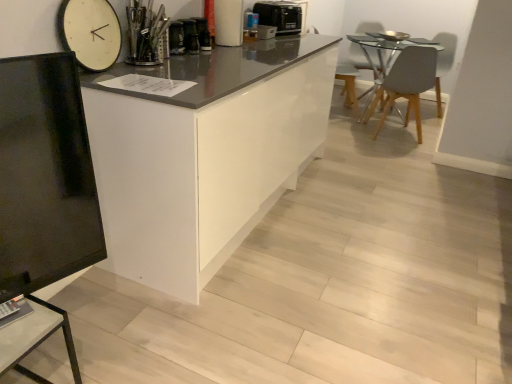
Image resolution: width=512 pixels, height=384 pixels. Identify the location of vacant area located to the right-hand side of white wooden clock at upper left. (141, 74).